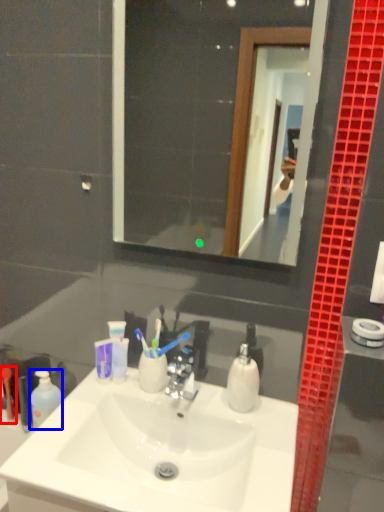
Question: Which point is closer to the camera, toiletry (highlighted by a red box) or mouthwash (highlighted by a blue box)?

Choices:
 (A) toiletry
 (B) mouthwash

Answer: (B)